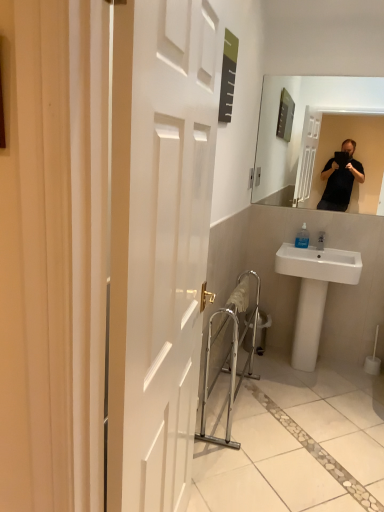
Question: Is metallic silver trash can at center at the right side of white ceramic sink at lower right?

Choices:
 (A) no
 (B) yes

Answer: (A)

Question: From a real-world perspective, is metallic silver trash can at center located higher than white ceramic sink at lower right?

Choices:
 (A) no
 (B) yes

Answer: (A)

Question: Is metallic silver trash can at center positioned in front of white ceramic sink at lower right?

Choices:
 (A) no
 (B) yes

Answer: (A)

Question: Does metallic silver trash can at center have a greater height compared to white ceramic sink at lower right?

Choices:
 (A) no
 (B) yes

Answer: (A)

Question: Can you confirm if metallic silver trash can at center is wider than white ceramic sink at lower right?

Choices:
 (A) no
 (B) yes

Answer: (A)

Question: From the image's perspective, is metallic silver trash can at center beneath white ceramic sink at lower right?

Choices:
 (A) yes
 (B) no

Answer: (A)

Question: Does silver metallic balustrade at lower center have a greater width compared to metallic silver trash can at center?

Choices:
 (A) no
 (B) yes

Answer: (B)

Question: Can you confirm if silver metallic balustrade at lower center is thinner than metallic silver trash can at center?

Choices:
 (A) no
 (B) yes

Answer: (A)

Question: From the image's perspective, would you say silver metallic balustrade at lower center is positioned over metallic silver trash can at center?

Choices:
 (A) no
 (B) yes

Answer: (B)

Question: From a real-world perspective, is silver metallic balustrade at lower center over metallic silver trash can at center?

Choices:
 (A) no
 (B) yes

Answer: (B)

Question: Can metallic silver trash can at center be found inside silver metallic balustrade at lower center?

Choices:
 (A) no
 (B) yes

Answer: (A)

Question: Are silver metallic balustrade at lower center and metallic silver trash can at center making contact?

Choices:
 (A) no
 (B) yes

Answer: (A)

Question: Considering the relative sizes of metallic silver trash can at center and silver metallic balustrade at lower center in the image provided, is metallic silver trash can at center taller than silver metallic balustrade at lower center?

Choices:
 (A) no
 (B) yes

Answer: (A)